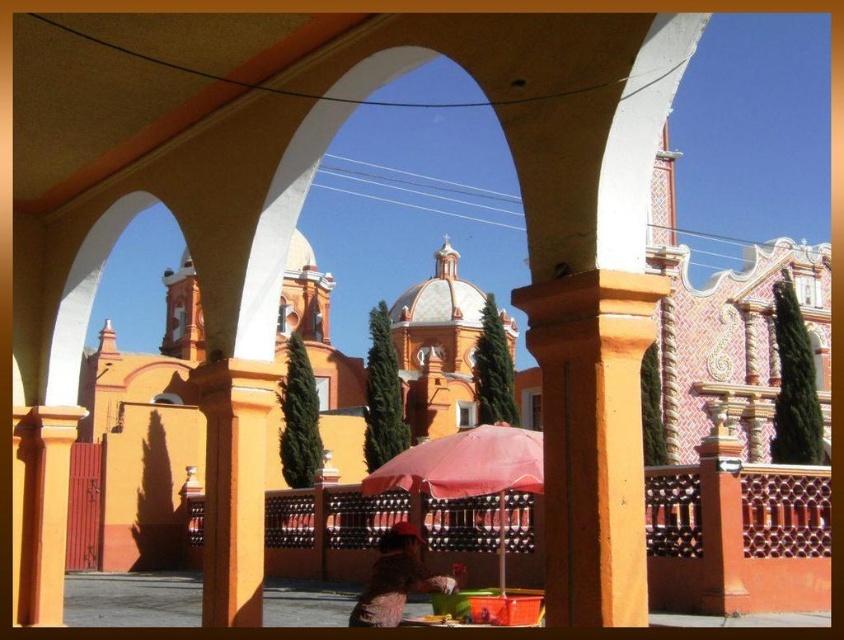
In the scene shown: Does orange painted pillar at center have a smaller size compared to pink fabric umbrella at lower center?

Yes.

The image size is (844, 640). Find the location of `orange painted pillar at center`. orange painted pillar at center is located at coordinates click(41, 509).

You are a GUI agent. You are given a task and a screenshot of the screen. Output one action in this format:
    pyautogui.click(x=<x>, y=<y>)
    Task: Click on the orange painted pillar at center
    The image size is (844, 640).
    Given the screenshot: What is the action you would take?
    pyautogui.click(x=41, y=509)

Can you confirm if matte orange column at center is positioned below orange painted pillar at center?

Indeed, matte orange column at center is positioned under orange painted pillar at center.

Is matte orange column at center closer to the viewer compared to orange painted pillar at center?

Yes.

Image resolution: width=844 pixels, height=640 pixels. What do you see at coordinates (233, 484) in the screenshot?
I see `matte orange column at center` at bounding box center [233, 484].

Where is `matte orange column at center`? This screenshot has height=640, width=844. matte orange column at center is located at coordinates (233, 484).

Does orange stucco column at center have a lesser height compared to matte orange column at center?

In fact, orange stucco column at center may be taller than matte orange column at center.

Between orange stucco column at center and matte orange column at center, which one appears on the right side from the viewer's perspective?

Positioned to the right is orange stucco column at center.

Does point (540, 305) come farther from viewer compared to point (253, 493)?

That is False.

Where is `orange stucco column at center`? orange stucco column at center is located at coordinates (592, 438).